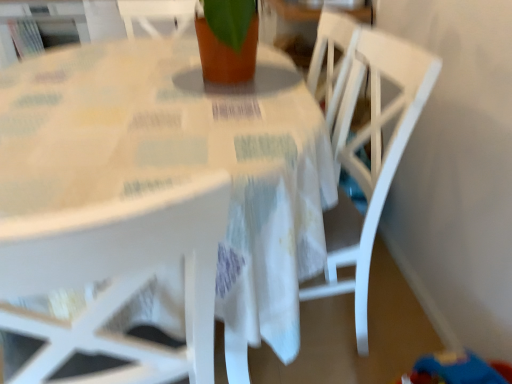
Question: From a real-world perspective, is white fabric table at center physically located above or below white wood chair at center?

Choices:
 (A) below
 (B) above

Answer: (A)

Question: In terms of height, does white fabric table at center look taller or shorter compared to white wood chair at center?

Choices:
 (A) short
 (B) tall

Answer: (A)

Question: Does point (245, 314) appear closer or farther from the camera than point (375, 61)?

Choices:
 (A) closer
 (B) farther

Answer: (A)

Question: In terms of height, does white wood chair at center look taller or shorter compared to white fabric table at center?

Choices:
 (A) tall
 (B) short

Answer: (A)

Question: Would you say white wood chair at center is inside or outside white fabric table at center?

Choices:
 (A) outside
 (B) inside

Answer: (B)

Question: Is white wood chair at center wider or thinner than white fabric table at center?

Choices:
 (A) wide
 (B) thin

Answer: (B)

Question: Is point (349, 147) positioned closer to the camera than point (9, 92)?

Choices:
 (A) farther
 (B) closer

Answer: (A)